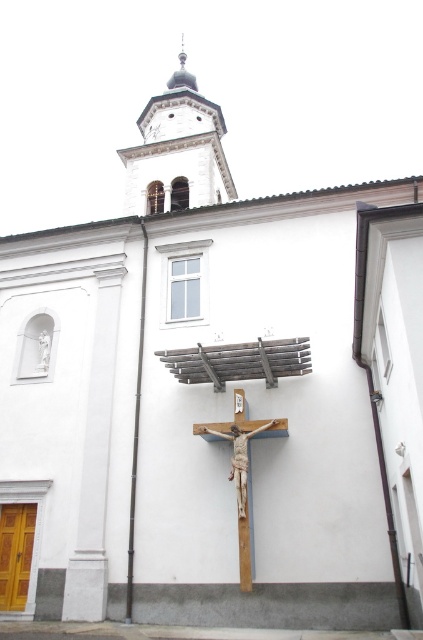
Which is above, smooth white stone spire at upper center or wooden cross at center?

smooth white stone spire at upper center

Can you confirm if smooth white stone spire at upper center is wider than wooden cross at center?

Indeed, smooth white stone spire at upper center has a greater width compared to wooden cross at center.

Image resolution: width=423 pixels, height=640 pixels. Find the location of `smooth white stone spire at upper center`. smooth white stone spire at upper center is located at coordinates (176, 150).

Identify the location of smooth white stone spire at upper center. (176, 150).